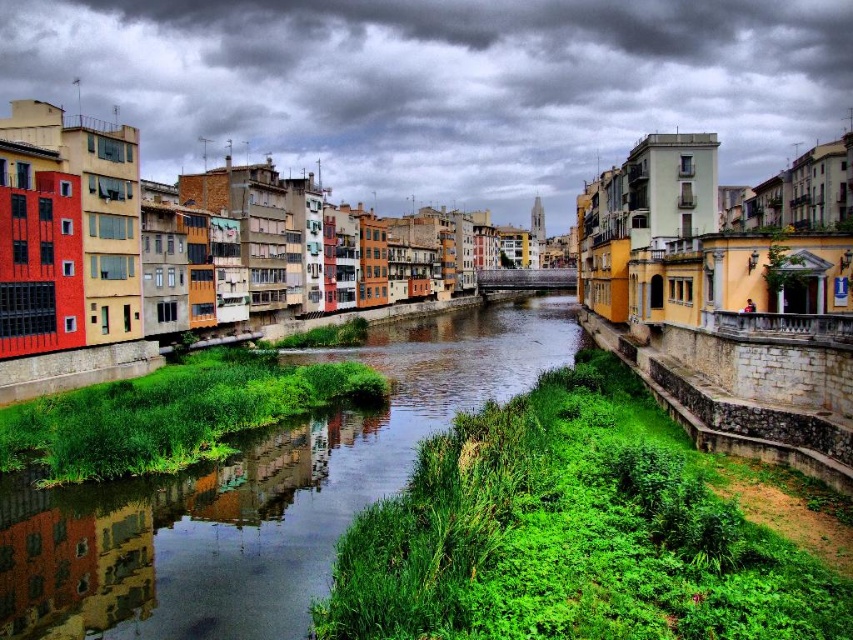
You are standing on the green grassy bank at center and want to look up to the cloudy sky at upper center. In which direction should you turn your head?

You should turn your head to the right to look up at the cloudy sky at upper center since it is positioned to the right of the green grassy bank at center.

You are standing on the riverside and see the point marked at coordinates [440,84]. What does this point represent in the scene?

The point at coordinates [440,84] marks the cloudy sky at upper center.